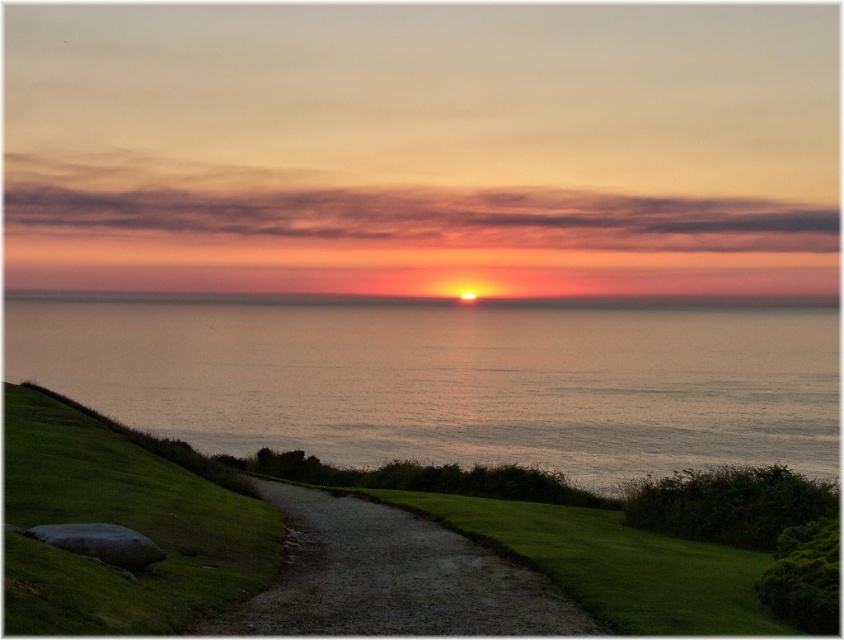
I want to click on green grassy at lower left, so point(122,524).

Is green grassy at lower left closer to the viewer compared to dirt/gravel path at center?

Yes.

At what (x,y) coordinates should I click in order to perform the action: click on green grassy at lower left. Please return your answer as a coordinate pair (x, y). Looking at the image, I should click on click(x=122, y=524).

Does silvery water at center have a lesser width compared to dirt/gravel path at center?

Incorrect, silvery water at center's width is not less than dirt/gravel path at center's.

Who is positioned more to the left, silvery water at center or dirt/gravel path at center?

Positioned to the left is silvery water at center.

Which is behind, point (823, 369) or point (300, 547)?

Point (823, 369)

The image size is (844, 640). Find the location of `silvery water at center`. silvery water at center is located at coordinates (452, 381).

Does silvery water at center appear under green grassy at lower left?

No.

Is point (253, 385) positioned after point (14, 579)?

Yes, point (253, 385) is farther from viewer.

What are the coordinates of `silvery water at center` in the screenshot? It's located at (452, 381).